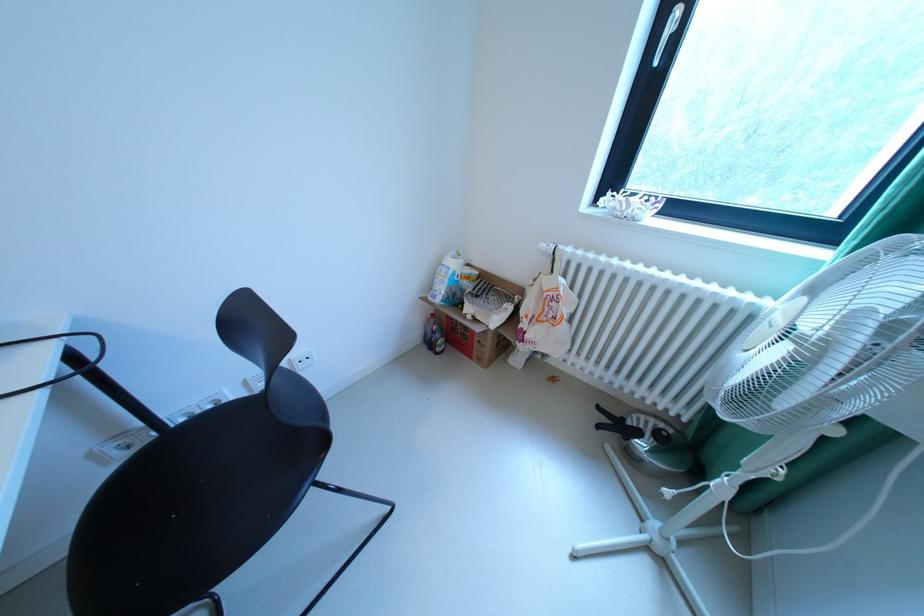
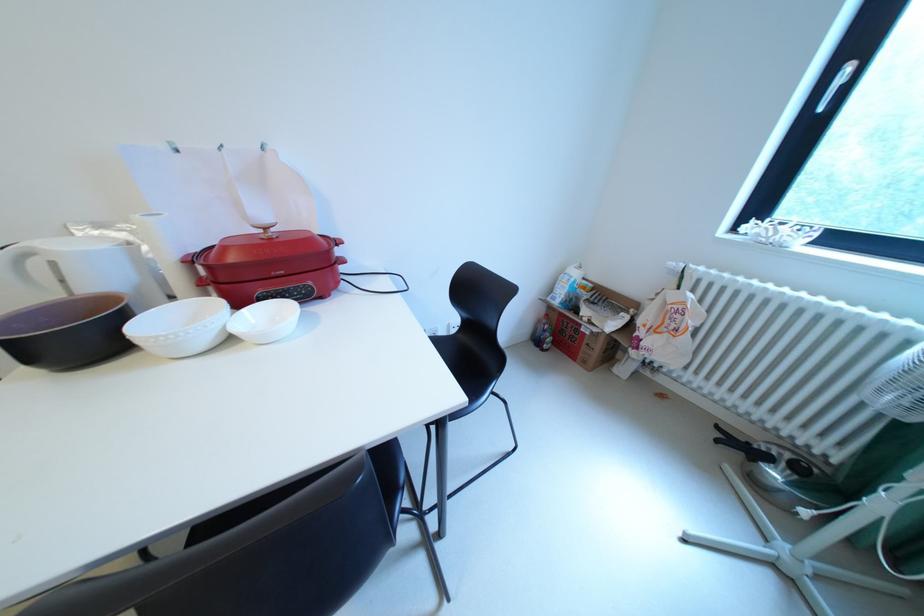
Question: The first image is from the beginning of the video and the second image is from the end. How did the camera likely rotate when shooting the video?

Choices:
 (A) Left
 (B) Right
 (C) Up
 (D) Down

Answer: (A)